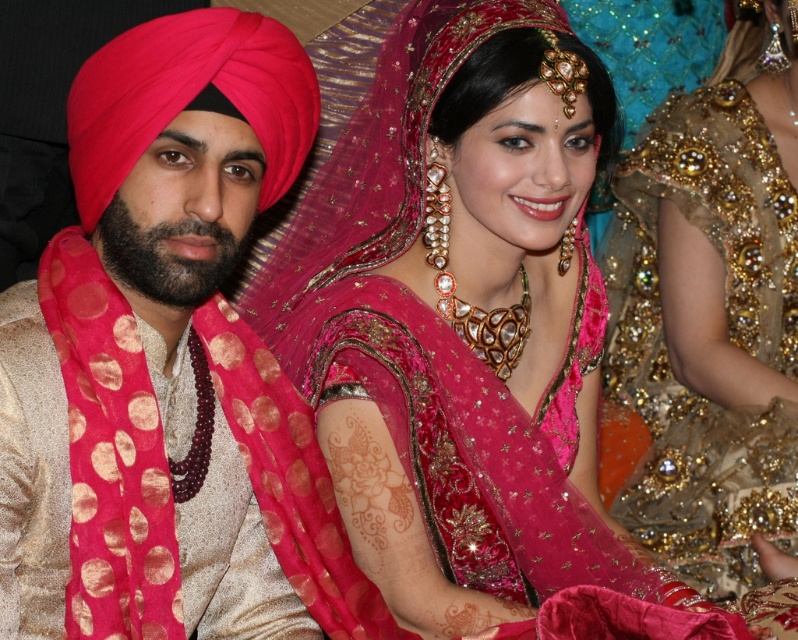
Question: Among these objects, which one is nearest to the camera?

Choices:
 (A) matte gold kurta at center
 (B) gold sequined lehenga at right
 (C) matte pink turban at left

Answer: (A)

Question: Considering the real-world distances, which object is farthest from the matte pink turban at left?

Choices:
 (A) matte gold kurta at center
 (B) matte pink fabric at center

Answer: (B)

Question: Does matte gold kurta at center have a greater width compared to matte pink turban at left?

Choices:
 (A) no
 (B) yes

Answer: (B)

Question: Can you confirm if matte pink fabric at center is positioned to the right of gold sequined lehenga at right?

Choices:
 (A) no
 (B) yes

Answer: (A)

Question: Considering the real-world distances, which object is farthest from the matte gold kurta at center?

Choices:
 (A) gold sequined lehenga at right
 (B) matte pink turban at left
 (C) matte pink fabric at center

Answer: (A)

Question: Does matte pink fabric at center appear on the right side of gold sequined lehenga at right?

Choices:
 (A) no
 (B) yes

Answer: (A)